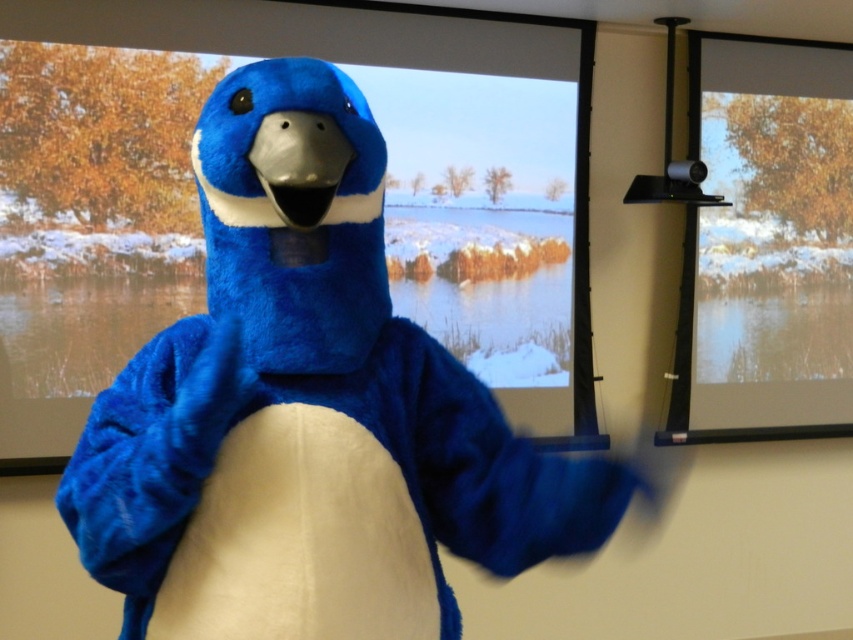
This screenshot has height=640, width=853. What do you see at coordinates (308, 412) in the screenshot?
I see `blue plush penguin at center` at bounding box center [308, 412].

Is blue plush penguin at center to the left of transparent glass window at upper right from the viewer's perspective?

Yes, blue plush penguin at center is to the left of transparent glass window at upper right.

Which is behind, point (372, 605) or point (814, 148)?

The point (814, 148) is behind.

Where is `blue plush penguin at center`? The image size is (853, 640). blue plush penguin at center is located at coordinates (308, 412).